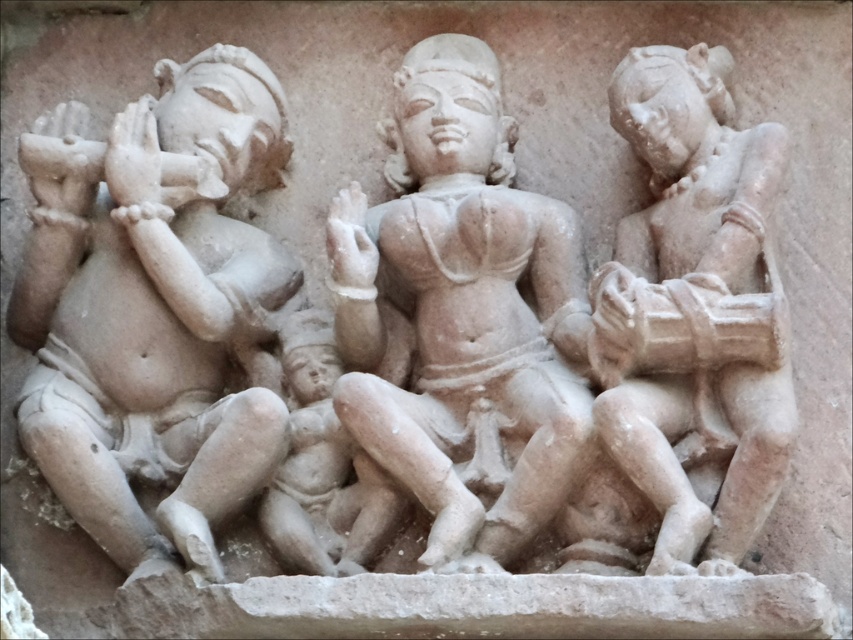
In the scene shown: You are an archaeologist examining a stone relief sculpture from an ancient Indian site. You notice the smooth beige statue at center. Given that your current position is 69.35 meters away from it, would you be able to clearly see the details of the statue from where you stand?

The smooth beige statue at center is 69.35 meters away from the camera. At that distance, it might be challenging to clearly see the details of the statue without the aid of a zoom lens or binoculars.

You are an art conservator examining the stone relief sculpture. You need to determine which of the two figures, the smooth beige statue at center or the smooth stone figure at right, requires a wider protective covering based on their sizes. Which one needs a larger covering?

The smooth beige statue at center requires a larger protective covering because its width is greater than that of the smooth stone figure at right.